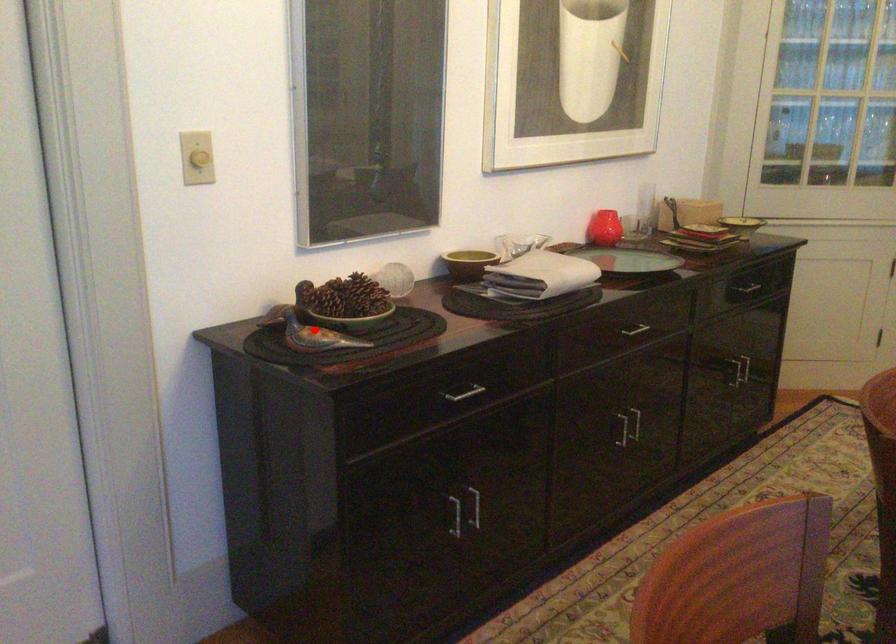
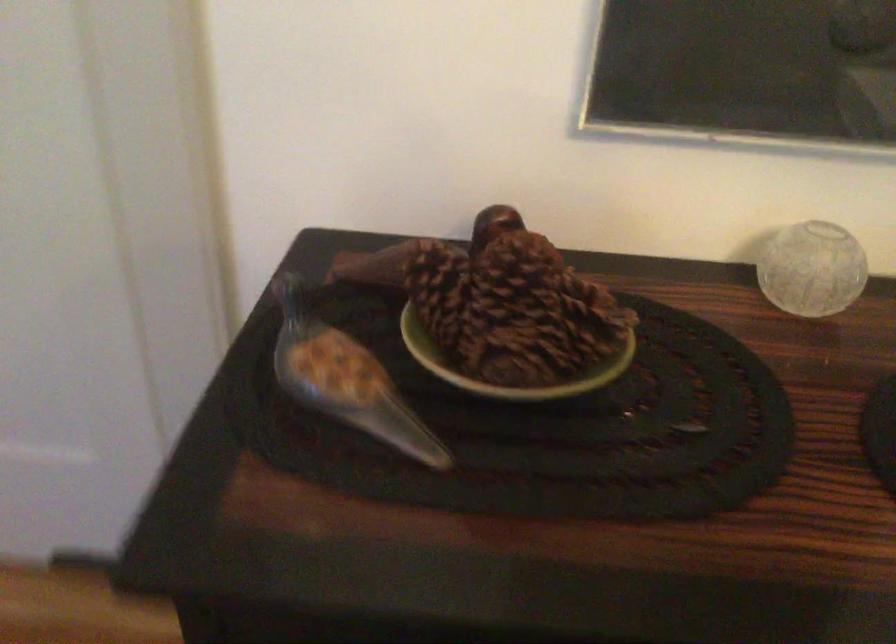
In the second image, find the point that corresponds to the highlighted location in the first image.

(347, 386)